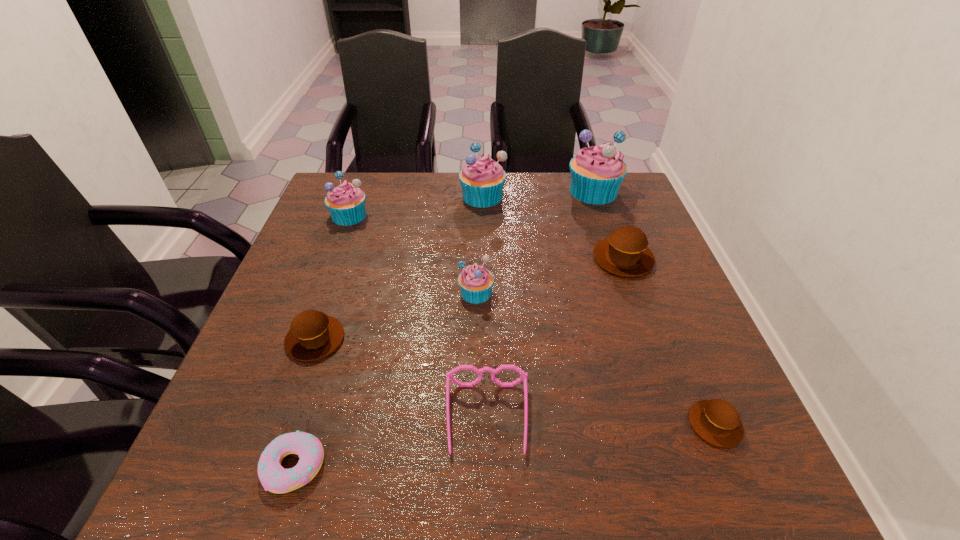
You are a GUI agent. You are given a task and a screenshot of the screen. Output one action in this format:
    pyautogui.click(x=<x>, y=<y>)
    Task: Click on the rightmost blue muffin
    
    Given the screenshot: What is the action you would take?
    pyautogui.click(x=597, y=172)

Locate an element on the screen. The height and width of the screenshot is (540, 960). the tallest muffin is located at coordinates (597, 172).

Image resolution: width=960 pixels, height=540 pixels. Identify the location of the second tallest muffin. (482, 179).

Find the location of a particular element. This screenshot has height=540, width=960. the eighth shortest object is located at coordinates (482, 179).

Where is `the seventh shortest object`? This screenshot has height=540, width=960. the seventh shortest object is located at coordinates (346, 203).

Find the location of a particular element. the third tallest muffin is located at coordinates (346, 203).

I want to click on the fifth farthest muffin, so click(x=475, y=281).

The width and height of the screenshot is (960, 540). What are the coordinates of `the smallest blue muffin` in the screenshot? It's located at (475, 281).

The height and width of the screenshot is (540, 960). Identify the location of the fourth farthest object. (625, 252).

Locate an element on the screen. the biggest brown muffin is located at coordinates (625, 252).